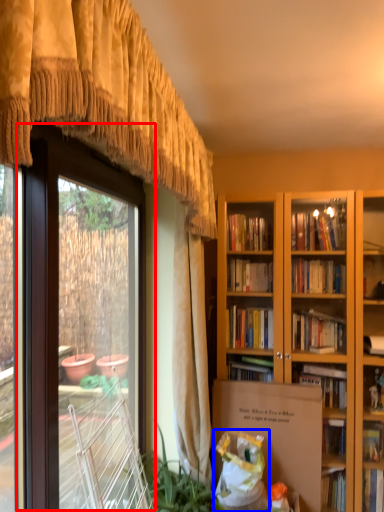
Question: Among these objects, which one is nearest to the camera, screen door (highlighted by a red box) or shopping bag (highlighted by a blue box)?

Choices:
 (A) screen door
 (B) shopping bag

Answer: (A)